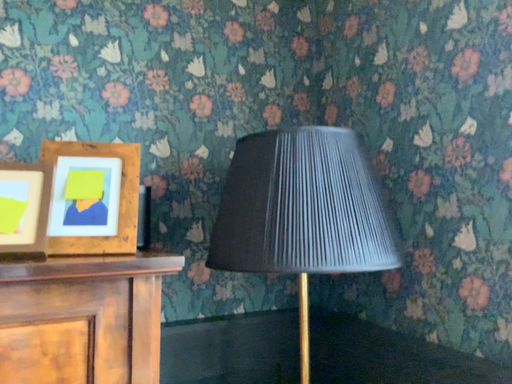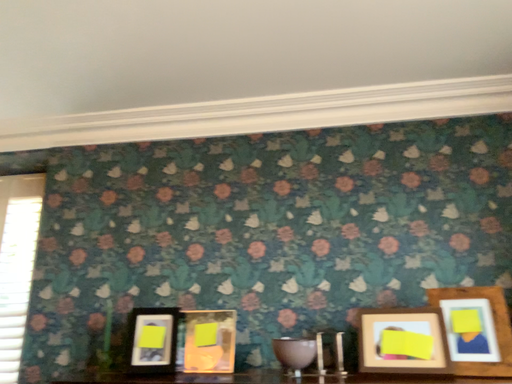
Question: Which way did the camera rotate in the video?

Choices:
 (A) rotated right
 (B) rotated left

Answer: (B)